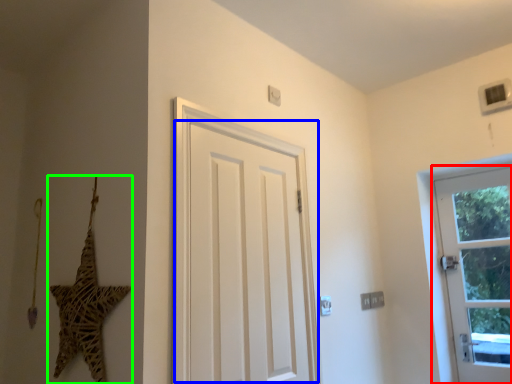
Question: Estimate the real-world distances between objects in this image. Which object is closer to door (highlighted by a red box), door (highlighted by a blue box) or star (highlighted by a green box)?

Choices:
 (A) door
 (B) star

Answer: (A)